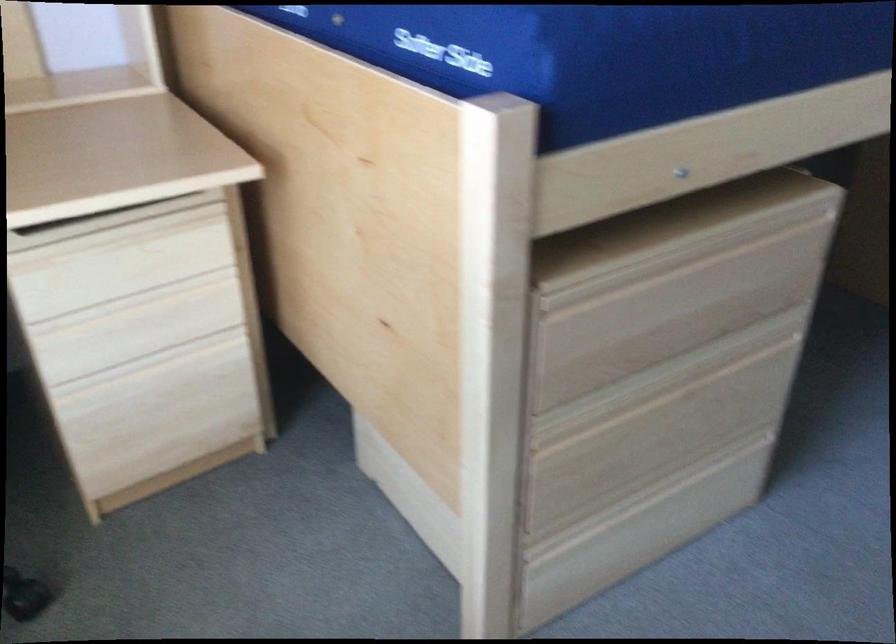
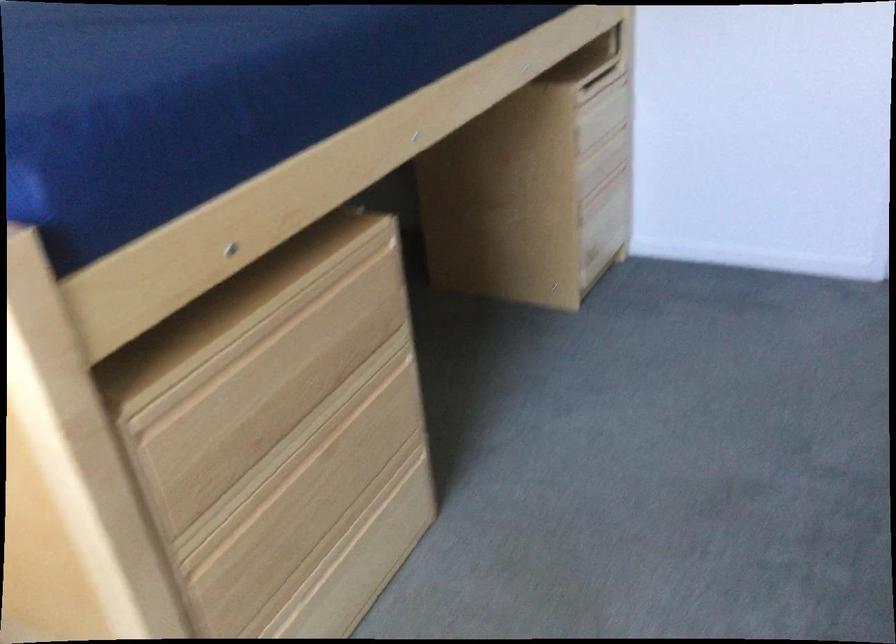
Question: How did the camera likely rotate?

Choices:
 (A) Left
 (B) Right
 (C) Up
 (D) Down

Answer: (B)